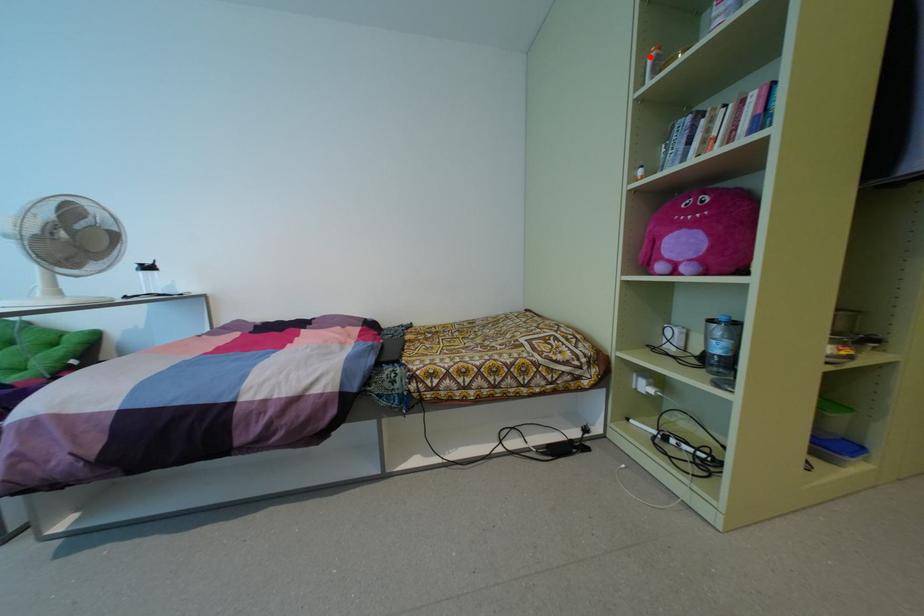
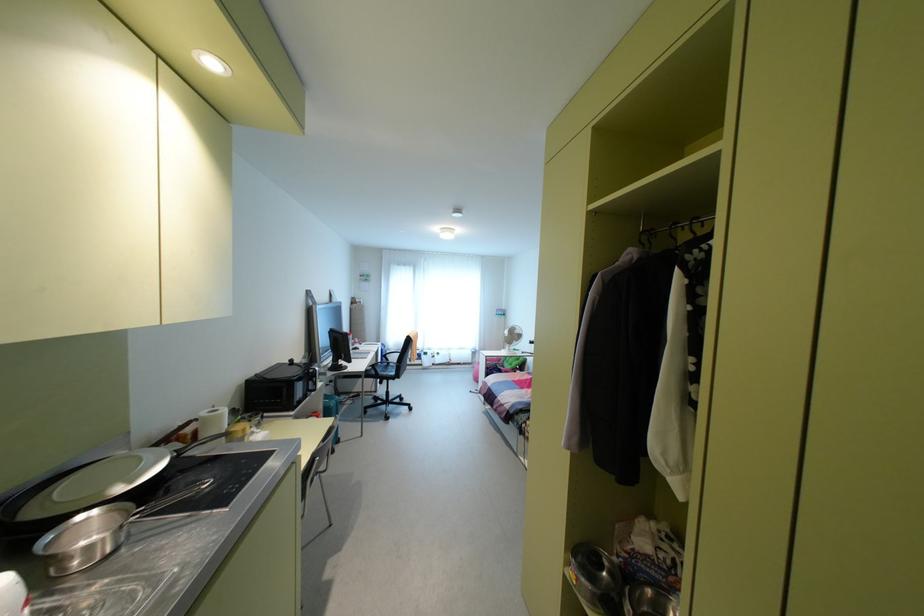
Question: I am providing you with two images of the same scene from different viewpoints. A red point is marked on the first image. Is the red point's position out of view in image 2?

Choices:
 (A) Yes
 (B) No

Answer: (A)